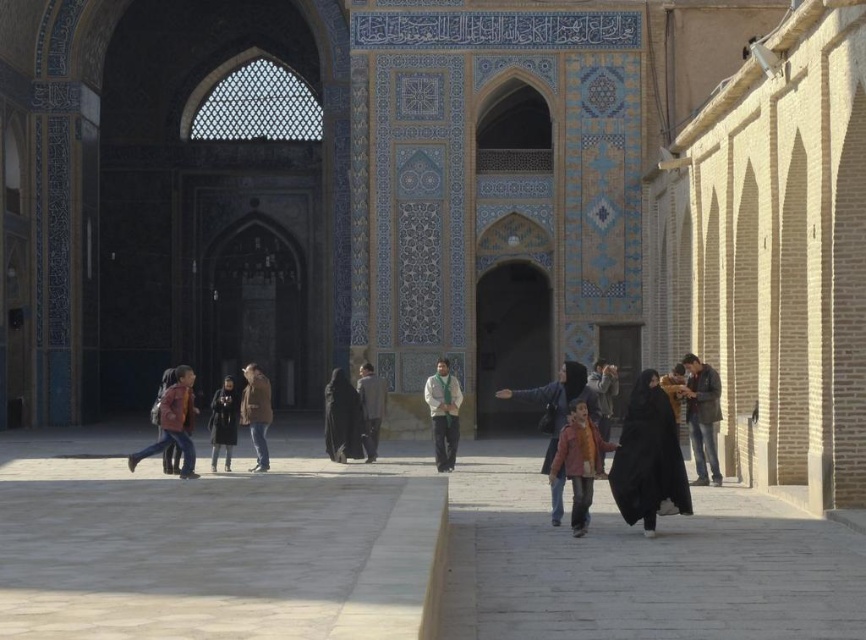
Is point (184, 385) positioned in front of point (244, 380)?

That is True.

Is point (178, 419) behind point (247, 365)?

No.

Is point (165, 406) closer to camera compared to point (265, 440)?

That is True.

At what (x,y) coordinates should I click in order to perform the action: click on matte brown backpack at center. Please return your answer as a coordinate pair (x, y). The image size is (866, 640). Looking at the image, I should click on (173, 420).

Which is below, dark brown leather jacket at right or matte brown backpack at center?

Positioned lower is matte brown backpack at center.

Is dark brown leather jacket at right shorter than matte brown backpack at center?

No.

Is point (701, 376) positioned behind point (153, 449)?

No, (701, 376) is closer to viewer.

Where is `dark brown leather jacket at right`? Image resolution: width=866 pixels, height=640 pixels. dark brown leather jacket at right is located at coordinates (702, 417).

How distant is matte pink jacket at center from dark gray fabric jacket at center?

They are 48.38 feet apart.

Can you confirm if matte pink jacket at center is positioned below dark gray fabric jacket at center?

Actually, matte pink jacket at center is above dark gray fabric jacket at center.

Who is more distant from viewer, [553,502] or [210,460]?

The point [210,460] is more distant.

Where is `matte pink jacket at center`? The width and height of the screenshot is (866, 640). matte pink jacket at center is located at coordinates (557, 403).